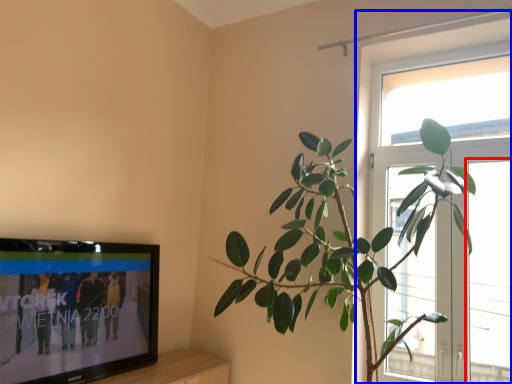
Question: Which object is further to the camera taking this photo, window (highlighted by a red box) or window (highlighted by a blue box)?

Choices:
 (A) window
 (B) window

Answer: (B)